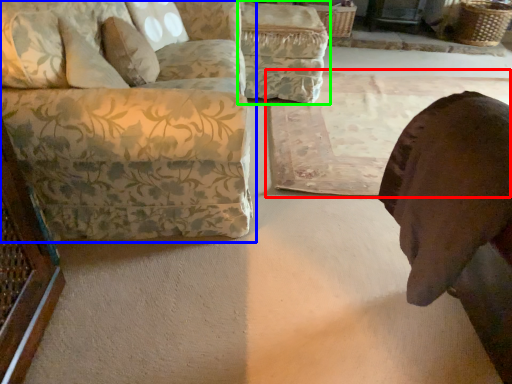
Question: Considering the real-world distances, which object is farthest from mat (highlighted by a red box)? studio couch (highlighted by a blue box) or swivel chair (highlighted by a green box)?

Choices:
 (A) studio couch
 (B) swivel chair

Answer: (A)